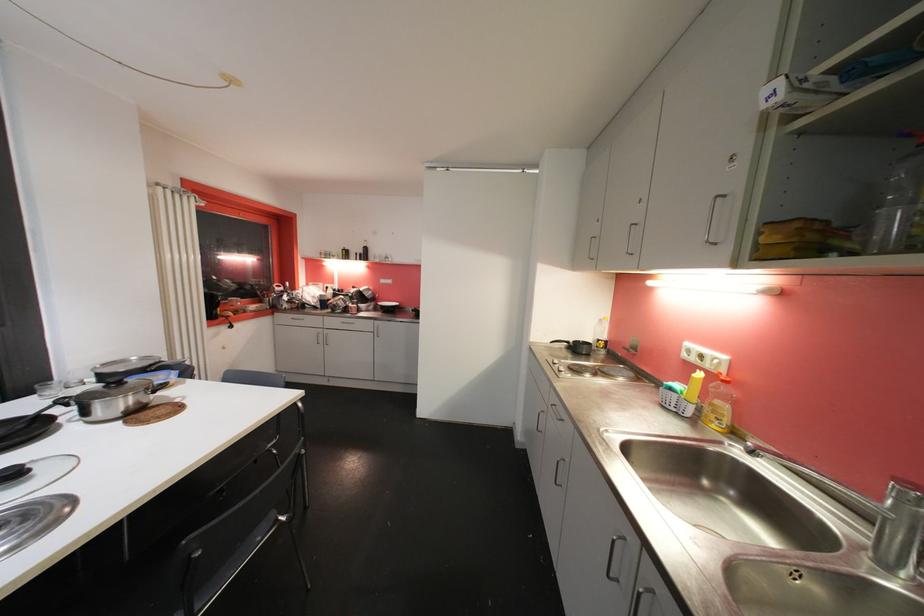
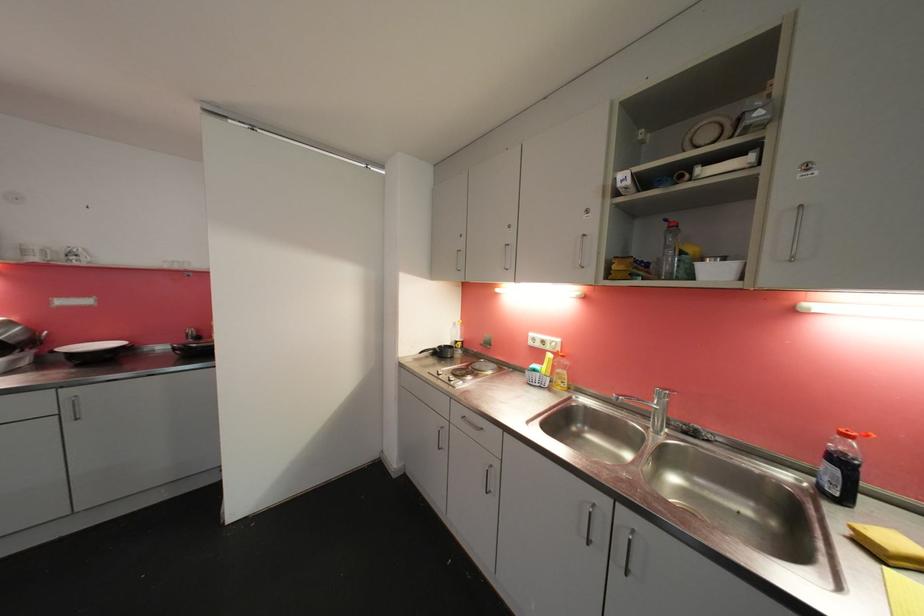
Locate, in the second image, the point that corresponds to (x=675, y=391) in the first image.

(540, 373)